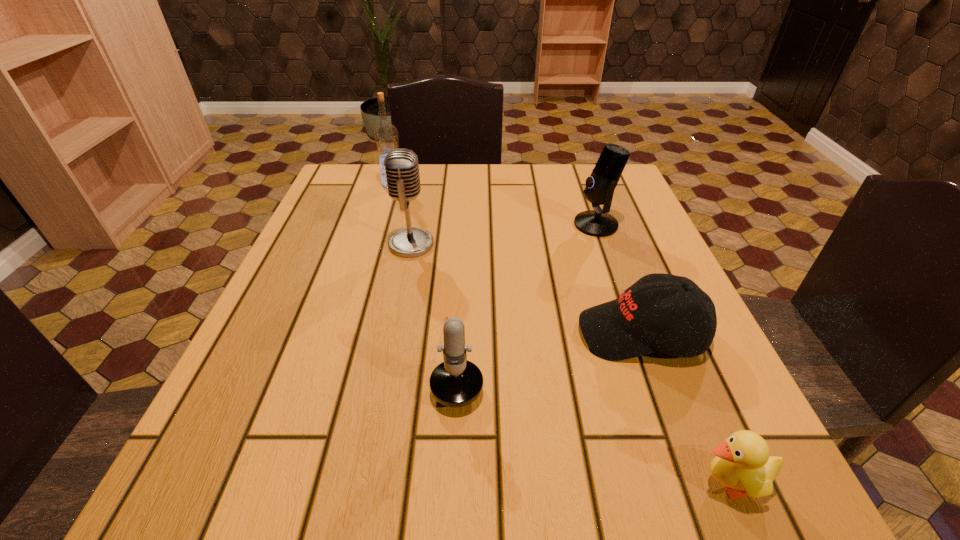
You are a GUI agent. You are given a task and a screenshot of the screen. Output one action in this format:
    pyautogui.click(x=<x>, y=<y>)
    Task: Click on the vacant area located 0.240m on the stand of the rightmost microphone
    
    Given the screenshot: What is the action you would take?
    pyautogui.click(x=468, y=225)

The height and width of the screenshot is (540, 960). What are the coordinates of `vacant region located on the stand of the rightmost microphone` in the screenshot? It's located at (503, 225).

The width and height of the screenshot is (960, 540). Find the location of `vacant space located 0.090m on the stand of the rightmost microphone`. vacant space located 0.090m on the stand of the rightmost microphone is located at coordinates coord(535,225).

Find the location of a particular element. vacant space located on the back of the nearest microphone is located at coordinates (464, 255).

At what (x,y) coordinates should I click in order to perform the action: click on vacant space situated on the front-facing side of the baseball cap. Please return your answer as a coordinate pair (x, y). Looking at the image, I should click on (496, 333).

Find the location of a particular element. free spot located 0.400m on the front-facing side of the baseball cap is located at coordinates (344, 333).

You are a GUI agent. You are given a task and a screenshot of the screen. Output one action in this format:
    pyautogui.click(x=<x>, y=<y>)
    Task: Click on the free space located 0.320m on the front-facing side of the baseball cap
    Image resolution: width=960 pixels, height=540 pixels.
    Given the screenshot: What is the action you would take?
    pyautogui.click(x=391, y=333)

Find the location of a particular element. This screenshot has height=540, width=960. free location located 0.280m on the front-facing side of the duckling is located at coordinates (473, 483).

Image resolution: width=960 pixels, height=540 pixels. What are the coordinates of `free region located 0.270m on the front-facing side of the duckling` in the screenshot? It's located at (481, 483).

Locate an element on the screen. vacant region located on the front-facing side of the duckling is located at coordinates (426, 483).